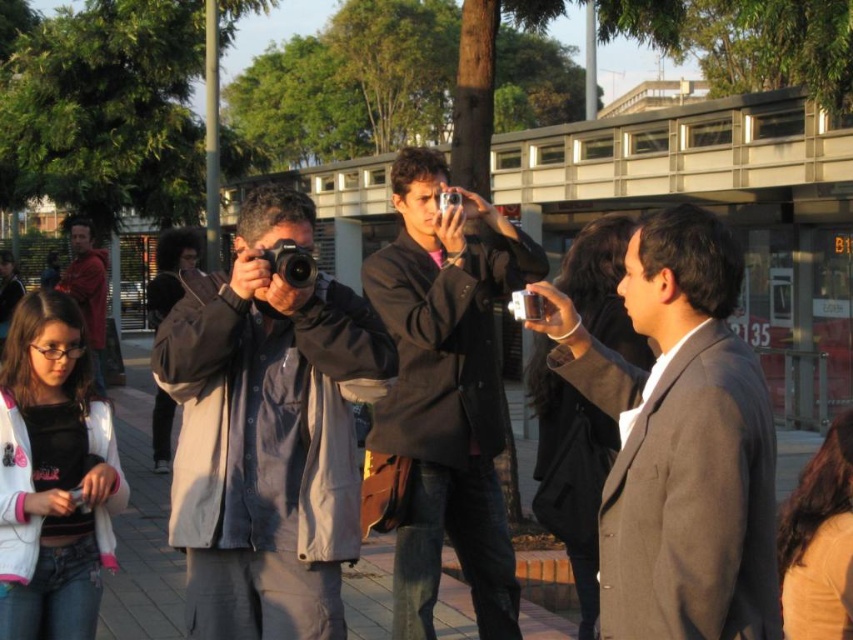
You are a photographer standing at the point marked by the coordinates point (444, 397). You want to take a photo of the bus shelter with the bus route number B135 displayed on its side. Which direction should you face to capture the bus shelter in your shot?

The point (444, 397) corresponds to the dark brown leather jacket at center. Since the bus shelter is in the background, you should face towards the background to capture the bus shelter with the bus route number B135 displayed on its side.

You are a photographer standing between the gray fabric jacket at center and the gray woolen suit at right. Which person is closer to your left side?

The gray fabric jacket at center is closer to your left side because it is positioned on the left side of the gray woolen suit at right.

You are a photographer who wants to carry both the dark brown leather jacket at center and the metallic silver camera at center in your backpack. The backpack has a maximum capacity of 10 liters. If the jacket takes up 6 liters and the camera takes up 4 liters, will both items fit?

The dark brown leather jacket at center takes up 6 liters and the metallic silver camera at center takes up 4 liters, totaling 10 liters. Since the backpack has a maximum capacity of 10 liters, both items will just fit perfectly without exceeding the limit.